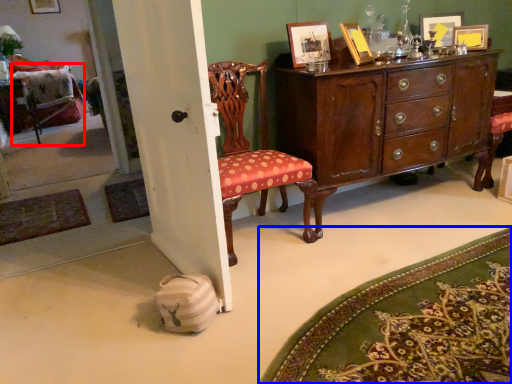
Question: Among these objects, which one is nearest to the camera, swivel chair (highlighted by a red box) or mat (highlighted by a blue box)?

Choices:
 (A) swivel chair
 (B) mat

Answer: (B)